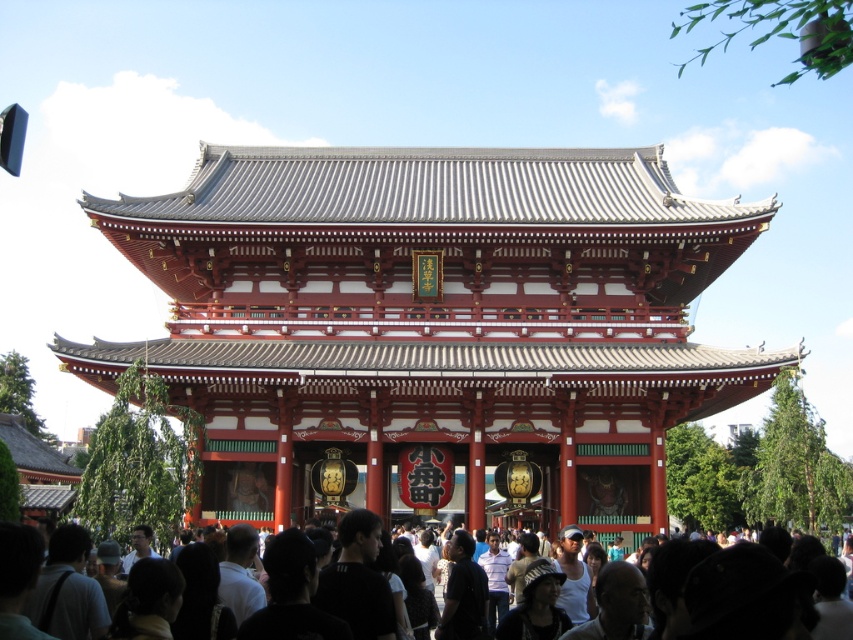
Question: Is red lacquered wood gate at center positioned before dark brown hair at lower center?

Choices:
 (A) yes
 (B) no

Answer: (B)

Question: Can you confirm if red lacquered wood gate at center is smaller than dark brown hair at lower center?

Choices:
 (A) yes
 (B) no

Answer: (B)

Question: Does red lacquered wood gate at center lie in front of dark brown hair at lower center?

Choices:
 (A) no
 (B) yes

Answer: (A)

Question: Which point appears farthest from the camera in this image?

Choices:
 (A) (236, 404)
 (B) (628, 592)

Answer: (A)

Question: Which point is closer to the camera?

Choices:
 (A) red lacquered wood gate at center
 (B) dark brown hair at lower center

Answer: (B)